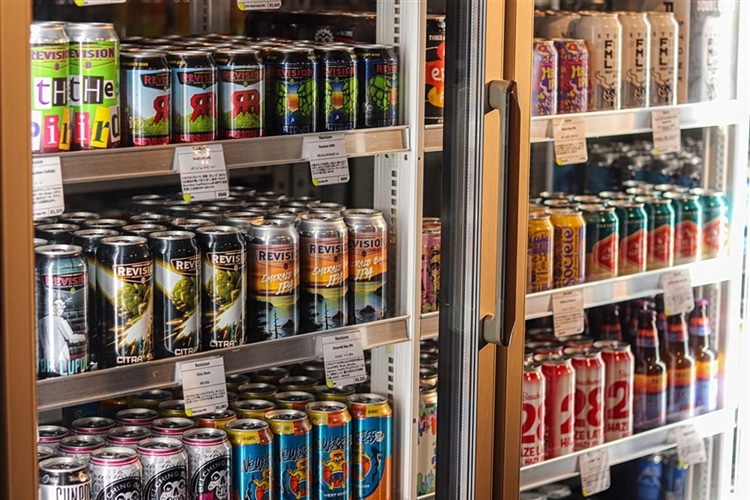
Where is `cans in front row on top shelf of left case`? Image resolution: width=750 pixels, height=500 pixels. cans in front row on top shelf of left case is located at coordinates (49, 115), (97, 95), (151, 104), (195, 98), (243, 94), (297, 92), (339, 88), (385, 86).